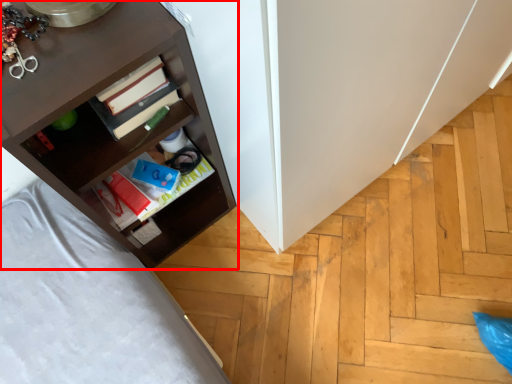
Question: From the image's perspective, considering the relative positions of shelf (annotated by the red box) and book in the image provided, where is shelf (annotated by the red box) located with respect to the staircase?

Choices:
 (A) below
 (B) above

Answer: (B)